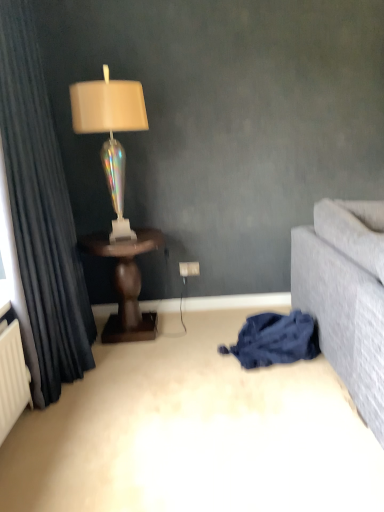
The width and height of the screenshot is (384, 512). Describe the element at coordinates (275, 340) in the screenshot. I see `blue cotton blanket at lower right` at that location.

What is the approximate height of iridescent glass lamp at left?

iridescent glass lamp at left is 36.84 inches in height.

The image size is (384, 512). Identify the location of white matte carpet at center. (194, 434).

Considering the relative sizes of blue cotton blanket at lower right and dark wood table at left in the image provided, is blue cotton blanket at lower right thinner than dark wood table at left?

Yes.

Based on the photo, between blue cotton blanket at lower right and dark wood table at left, which one appears on the right side from the viewer's perspective?

blue cotton blanket at lower right.

Is blue cotton blanket at lower right aimed at dark wood table at left?

No, blue cotton blanket at lower right is not turned towards dark wood table at left.

Can you confirm if blue cotton blanket at lower right is shorter than dark wood table at left?

Indeed, blue cotton blanket at lower right has a lesser height compared to dark wood table at left.

From a real-world perspective, between dark grey velvet curtain at left and blue cotton blanket at lower right, who is vertically lower?

In real-world perspective, blue cotton blanket at lower right is lower.

Can you confirm if dark grey velvet curtain at left is bigger than blue cotton blanket at lower right?

Indeed, dark grey velvet curtain at left has a larger size compared to blue cotton blanket at lower right.

Which of these two, dark grey velvet curtain at left or blue cotton blanket at lower right, stands taller?

dark grey velvet curtain at left is taller.

From the image's perspective, is dark grey velvet curtain at left beneath blue cotton blanket at lower right?

No, from the image's perspective, dark grey velvet curtain at left is not beneath blue cotton blanket at lower right.

Is point (109, 335) positioned before point (181, 506)?

That is False.

Can you tell me how much dark wood table at left and white matte carpet at center differ in facing direction?

The angle between the facing direction of dark wood table at left and the facing direction of white matte carpet at center is 178 degrees.

From a real-world perspective, is dark wood table at left above or below white matte carpet at center?

From a real-world perspective, dark wood table at left is physically above white matte carpet at center.

Could you tell me if dark wood table at left is turned towards white matte carpet at center?

No.

Locate an element on the screen. This screenshot has width=384, height=512. curtain above the white matte carpet at center (from a real-world perspective) is located at coordinates (41, 213).

Is white matte carpet at center aimed at dark grey velvet curtain at left?

A: No.

From a real-world perspective, between white matte carpet at center and dark grey velvet curtain at left, who is vertically lower?

From a 3D spatial view, white matte carpet at center is below.

Is white matte carpet at center thinner than dark grey velvet curtain at left?

No, white matte carpet at center is not thinner than dark grey velvet curtain at left.

Is there a large distance between white matte carpet at center and iridescent glass lamp at left?

That's right, there is a large distance between white matte carpet at center and iridescent glass lamp at left.

Which of these two, white matte carpet at center or iridescent glass lamp at left, is bigger?

iridescent glass lamp at left is bigger.

Based on the photo, considering the relative positions of white matte carpet at center and iridescent glass lamp at left in the image provided, is white matte carpet at center to the right of iridescent glass lamp at left from the viewer's perspective?

Yes.

Locate an element on the screen. lamp located on the left of dark wood table at left is located at coordinates (110, 132).

Can you confirm if dark wood table at left is positioned to the right of iridescent glass lamp at left?

Yes.

What's the angular difference between dark wood table at left and iridescent glass lamp at left's facing directions?

There is a 0.531-degree angle between the facing directions of dark wood table at left and iridescent glass lamp at left.

Considering the relative sizes of dark wood table at left and iridescent glass lamp at left in the image provided, is dark wood table at left shorter than iridescent glass lamp at left?

Yes, dark wood table at left is shorter than iridescent glass lamp at left.

Can you confirm if white matte carpet at center is positioned to the right of blue cotton blanket at lower right?

No, white matte carpet at center is not to the right of blue cotton blanket at lower right.

Considering the sizes of objects white matte carpet at center and blue cotton blanket at lower right in the image provided, who is smaller, white matte carpet at center or blue cotton blanket at lower right?

blue cotton blanket at lower right.

From the picture: Which is nearer, [281,411] or [307,324]?

Point [281,411] appears to be closer to the viewer than point [307,324].

From the image's perspective, is white matte carpet at center on top of blue cotton blanket at lower right?

Incorrect, from the image's perspective, white matte carpet at center is lower than blue cotton blanket at lower right.

At what (x,y) coordinates should I click in order to perform the action: click on table behind the blue cotton blanket at lower right. Please return your answer as a coordinate pair (x, y). Looking at the image, I should click on (126, 283).

There is a blue cotton blanket at lower right. Identify the location of curtain above it (from a real-world perspective). (41, 213).

Looking at the image, which one is located further to iridescent glass lamp at left, dark grey velvet curtain at left or blue cotton blanket at lower right?

blue cotton blanket at lower right lies further to iridescent glass lamp at left than the other object.

Looking at the image, which one is located further to blue cotton blanket at lower right, iridescent glass lamp at left or dark grey velvet curtain at left?

Among the two, dark grey velvet curtain at left is located further to blue cotton blanket at lower right.

Considering their positions, is dark wood table at left positioned closer to iridescent glass lamp at left than blue cotton blanket at lower right?

dark wood table at left lies closer to iridescent glass lamp at left than the other object.

From the image, which object appears to be farther from blue cotton blanket at lower right, white matte carpet at center or dark wood table at left?

Based on the image, dark wood table at left appears to be further to blue cotton blanket at lower right.

When comparing their distances from blue cotton blanket at lower right, does dark wood table at left or dark grey velvet curtain at left seem closer?

Based on the image, dark wood table at left appears to be nearer to blue cotton blanket at lower right.

Based on their spatial positions, is iridescent glass lamp at left or dark wood table at left closer to blue cotton blanket at lower right?

dark wood table at left.

Estimate the real-world distances between objects in this image. Which object is closer to dark wood table at left, white matte carpet at center or blue cotton blanket at lower right?

blue cotton blanket at lower right.

When comparing their distances from iridescent glass lamp at left, does dark grey velvet curtain at left or dark wood table at left seem closer?

dark grey velvet curtain at left is positioned closer to the anchor iridescent glass lamp at left.

This screenshot has width=384, height=512. In order to click on lamp located between dark grey velvet curtain at left and blue cotton blanket at lower right in the left-right direction in this screenshot , I will do `click(110, 132)`.

Image resolution: width=384 pixels, height=512 pixels. I want to click on table between dark grey velvet curtain at left and white matte carpet at center vertically, so click(x=126, y=283).

This screenshot has height=512, width=384. I want to click on curtain between iridescent glass lamp at left and white matte carpet at center vertically, so click(41, 213).

Find the location of `lamp located between dark grey velvet curtain at left and dark wood table at left in the depth direction`. lamp located between dark grey velvet curtain at left and dark wood table at left in the depth direction is located at coordinates (110, 132).